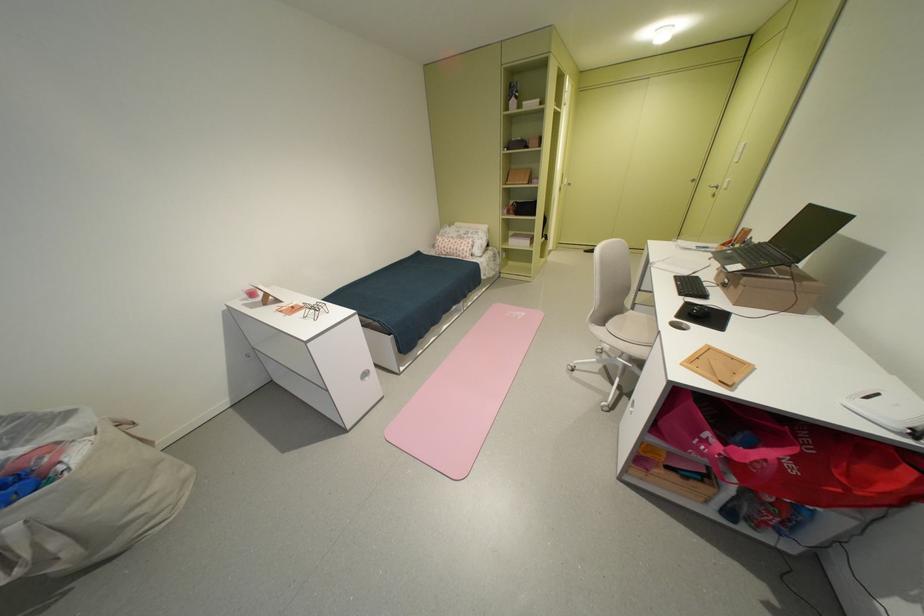
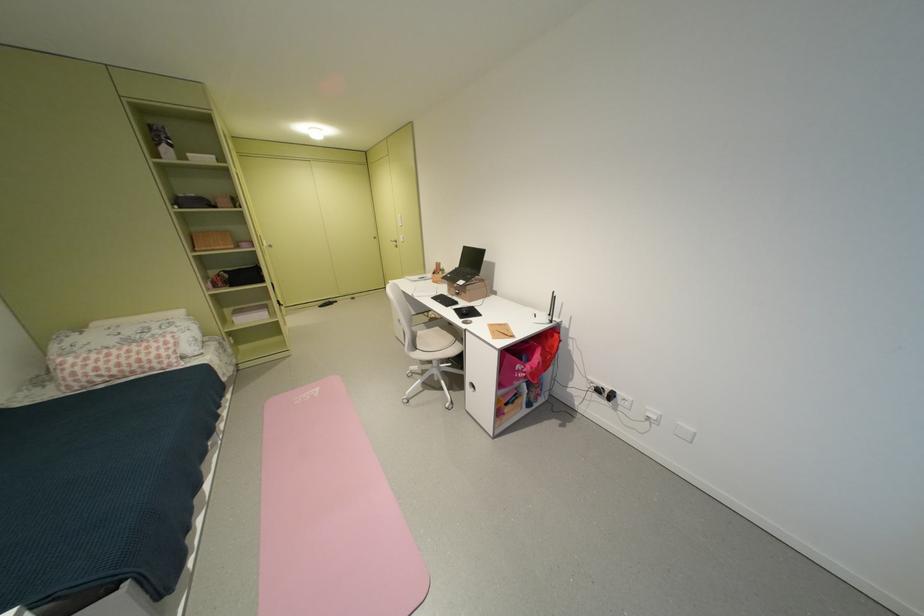
The point at (689, 294) is marked in the first image. Where is the corresponding point in the second image?

(456, 307)